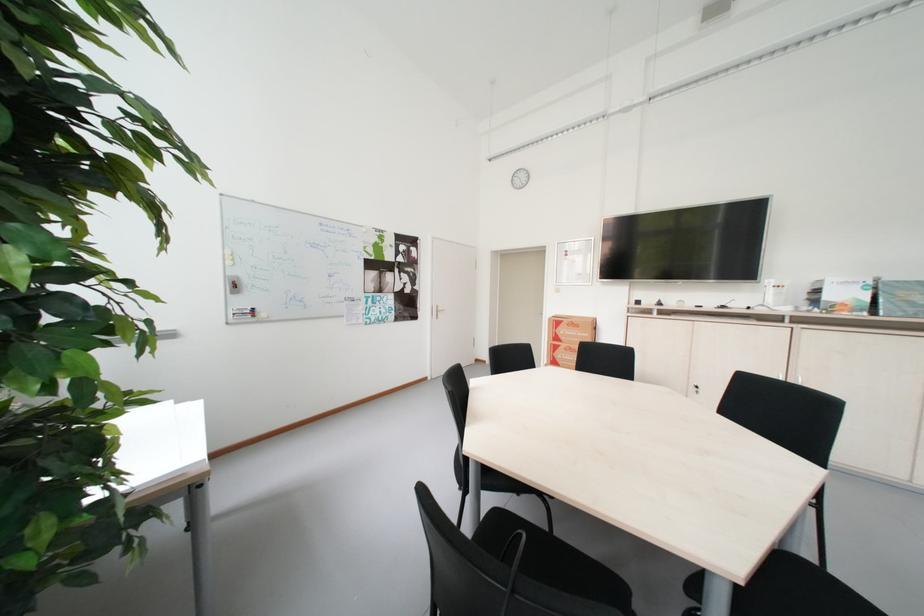
This screenshot has width=924, height=616. Describe the element at coordinates (536, 549) in the screenshot. I see `a black chair sitting surface` at that location.